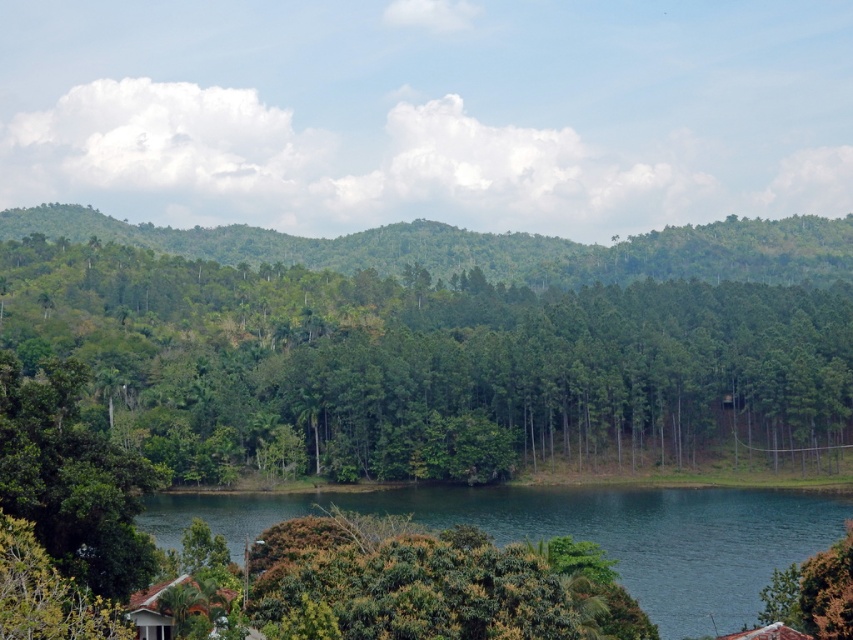
You are standing at the origin point of the coordinate system in the image. You want to reach the green leafy trees at center. Which direction should you move in to get there?

To reach the green leafy trees at center located at coordinate point [428,365], you should move northeast since the x and y coordinates are both positive and greater than zero.